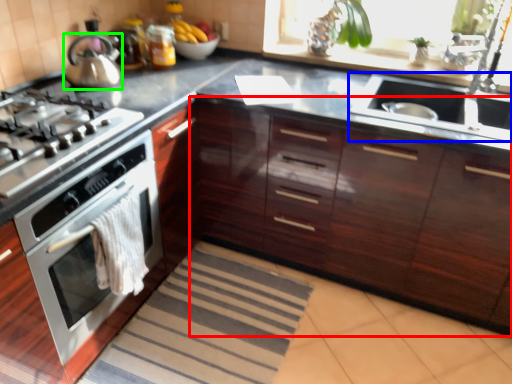
Question: Which is farther away from cabinetry (highlighted by a red box)? sink (highlighted by a blue box) or kitchen appliance (highlighted by a green box)?

Choices:
 (A) sink
 (B) kitchen appliance

Answer: (B)